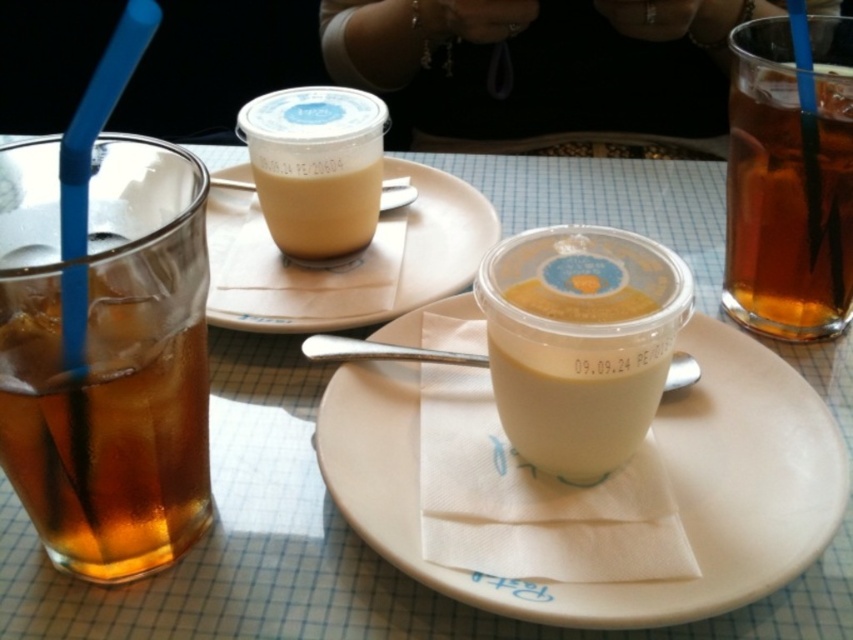
Can you confirm if matte plastic cup at center is positioned below matte plastic cup at upper center?

Yes.

Can you confirm if matte plastic cup at center is positioned above matte plastic cup at upper center?

No.

The image size is (853, 640). I want to click on matte plastic cup at center, so click(579, 340).

The height and width of the screenshot is (640, 853). In order to click on matte plastic cup at center in this screenshot , I will do `click(579, 340)`.

Who is positioned more to the left, translucent plastic cup at center or matte plastic cup at upper center?

From the viewer's perspective, translucent plastic cup at center appears more on the left side.

Which is below, translucent plastic cup at center or matte plastic cup at upper center?

translucent plastic cup at center

Is point (306, 324) positioned behind point (283, 157)?

No, it is in front of (283, 157).

At what (x,y) coordinates should I click in order to perform the action: click on translucent plastic cup at center. Please return your answer as a coordinate pair (x, y). This screenshot has width=853, height=640. Looking at the image, I should click on (347, 264).

Which of these two, brown translucent glass at right or matte plastic cup at upper center, stands taller?

brown translucent glass at right is taller.

Which of these two, brown translucent glass at right or matte plastic cup at upper center, stands shorter?

Standing shorter between the two is matte plastic cup at upper center.

The image size is (853, 640). I want to click on brown translucent glass at right, so click(788, 205).